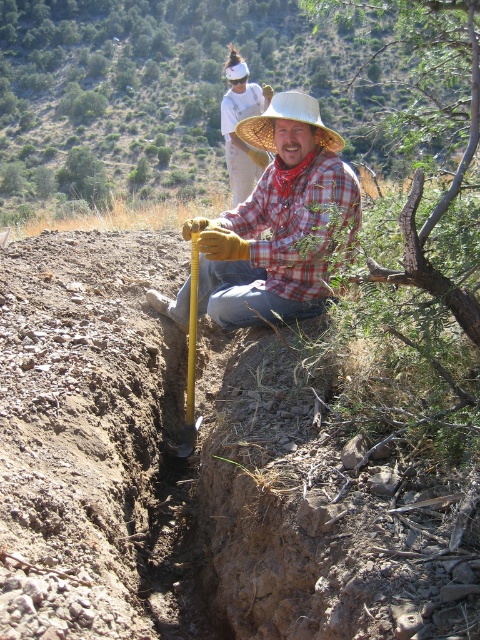
You are a hiker who has just arrived at the scene. You notice the point marked at coordinates [277,221]. What object is located at that point?

The point marked at coordinates [277,221] is located at the matte plaid shirt at center.

You are a hiker who has just arrived at the scene and want to know which piece of clothing is lower in position between the matte plaid shirt at center and the white cotton shirt at upper center. Can you tell me?

The matte plaid shirt at center is positioned under the white cotton shirt at upper center, so the matte plaid shirt at center is lower.